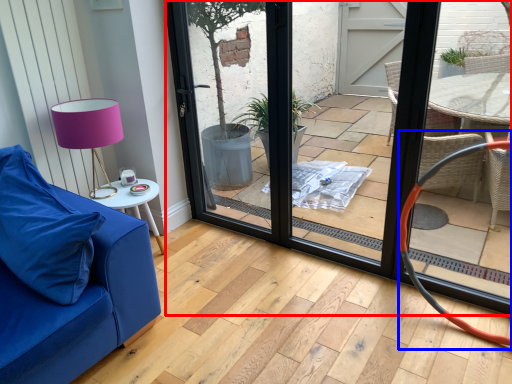
Question: Which point is further to the camera, door (highlighted by a red box) or armchair (highlighted by a blue box)?

Choices:
 (A) door
 (B) armchair

Answer: (B)